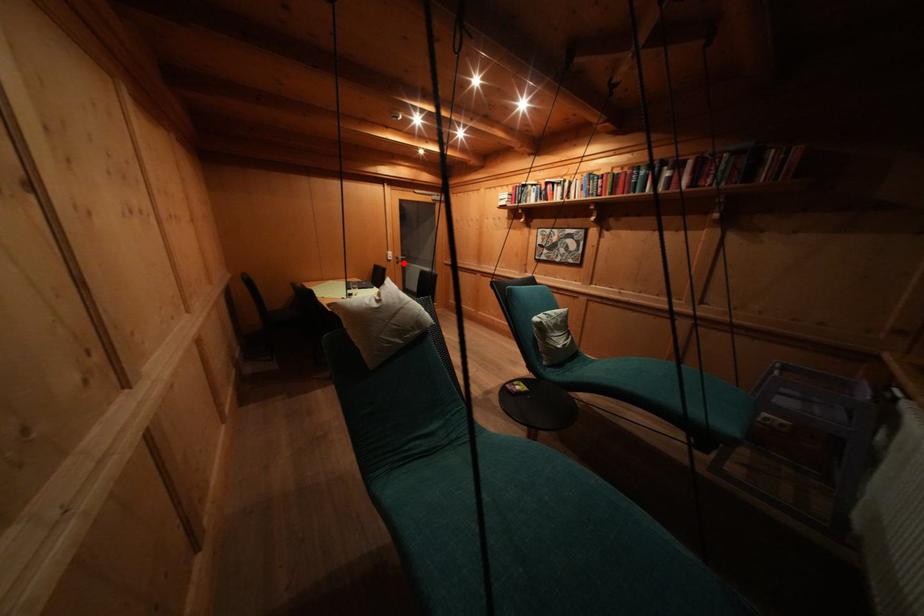
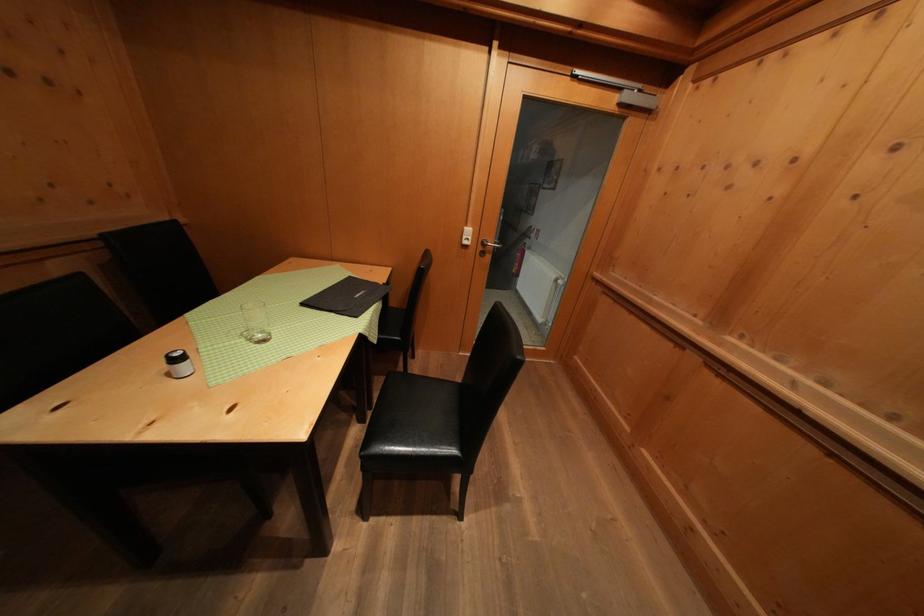
Find the pixel in the second image that matches the highlighted location in the first image.

(490, 249)